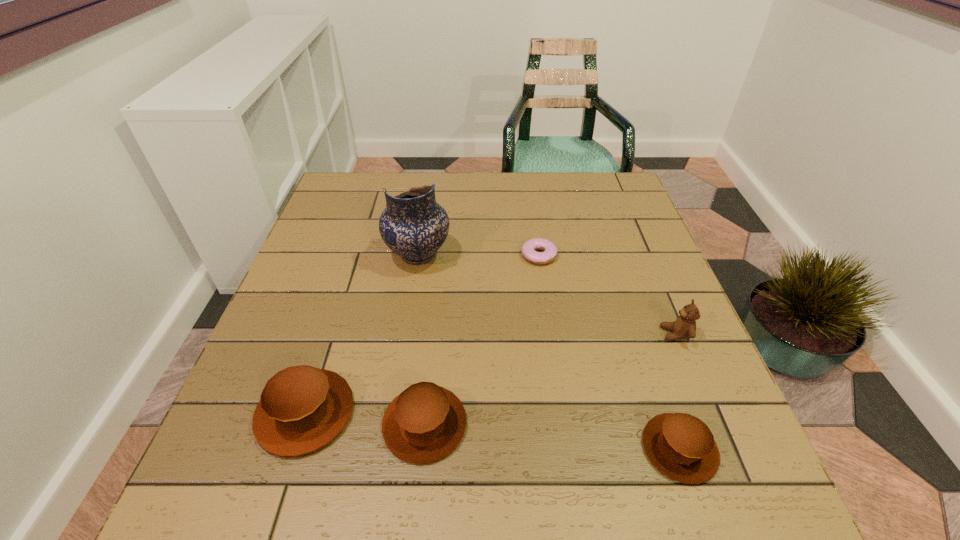
You are a GUI agent. You are given a task and a screenshot of the screen. Output one action in this format:
    pyautogui.click(x=<x>, y=<y>)
    Task: Click on the empty space that is in between the doughnut and the second shortest muffin
    
    Given the screenshot: What is the action you would take?
    pyautogui.click(x=482, y=340)

I want to click on vacant area that lies between the second shortest muffin and the leftmost muffin, so pos(365,418).

Locate an element on the screen. The height and width of the screenshot is (540, 960). free space between the shortest muffin and the doughnut is located at coordinates (610, 352).

Locate an element on the screen. Image resolution: width=960 pixels, height=540 pixels. free space between the second tallest muffin and the third farthest object is located at coordinates (550, 379).

Find the location of a particular element. This screenshot has width=960, height=540. vacant area that lies between the shortest object and the second shortest object is located at coordinates (610, 352).

The image size is (960, 540). I want to click on free spot between the leftmost muffin and the doughnut, so click(x=422, y=334).

In order to click on object that stands as the fourth closest to the leftmost muffin in this screenshot , I will do click(681, 446).

At what (x,y) coordinates should I click in order to perform the action: click on object that ranks as the closest to the second shortest object. Please return your answer as a coordinate pair (x, y). Image resolution: width=960 pixels, height=540 pixels. Looking at the image, I should click on (684, 327).

Find the location of a particular element. This screenshot has height=540, width=960. muffin that is the nearest to the doughnut is located at coordinates (426, 422).

Where is `muffin that is the third closest to the third farthest object`? This screenshot has width=960, height=540. muffin that is the third closest to the third farthest object is located at coordinates (302, 408).